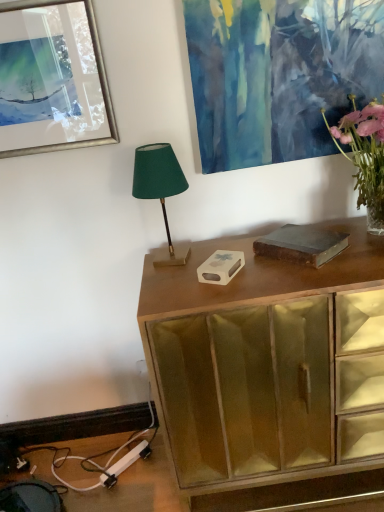
Locate an element on the screen. vacant area that is in front of green fabric lampshade at center is located at coordinates (173, 286).